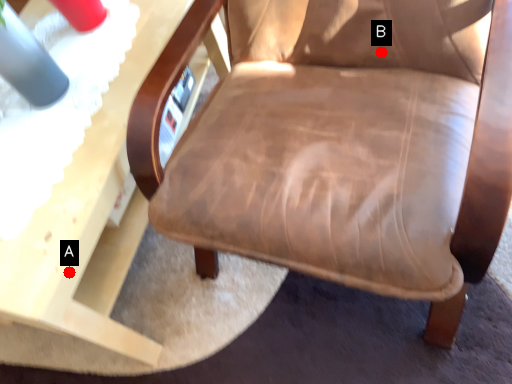
Question: Two points are circled on the image, labeled by A and B beside each circle. Among these points, which one is nearest to the camera?

Choices:
 (A) A is closer
 (B) B is closer

Answer: (A)